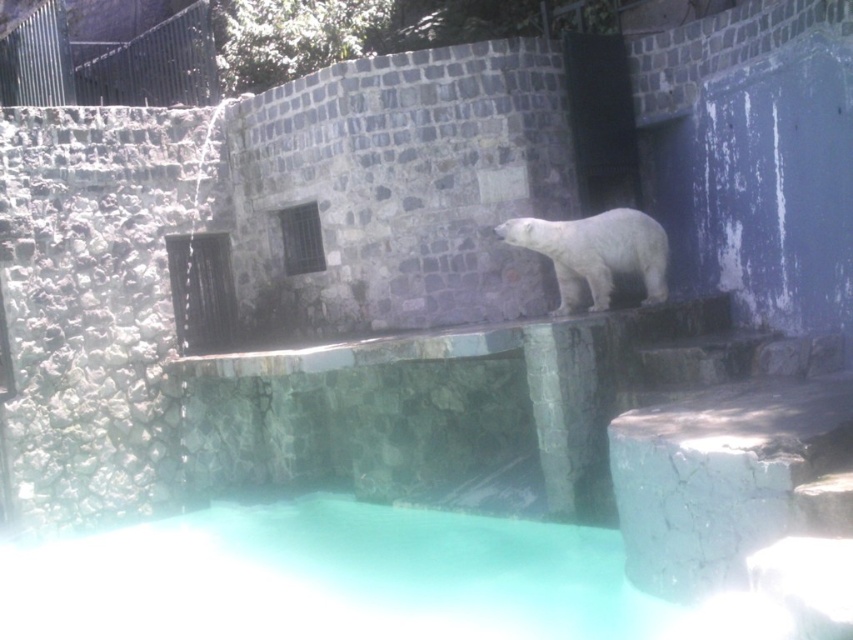
Which is above, smooth concrete ledge at center or white fur bear at center?

white fur bear at center is above.

Is smooth concrete ledge at center positioned behind white fur bear at center?

That is True.

Describe the element at coordinates (476, 340) in the screenshot. I see `smooth concrete ledge at center` at that location.

Identify the location of smooth concrete ledge at center. (476, 340).